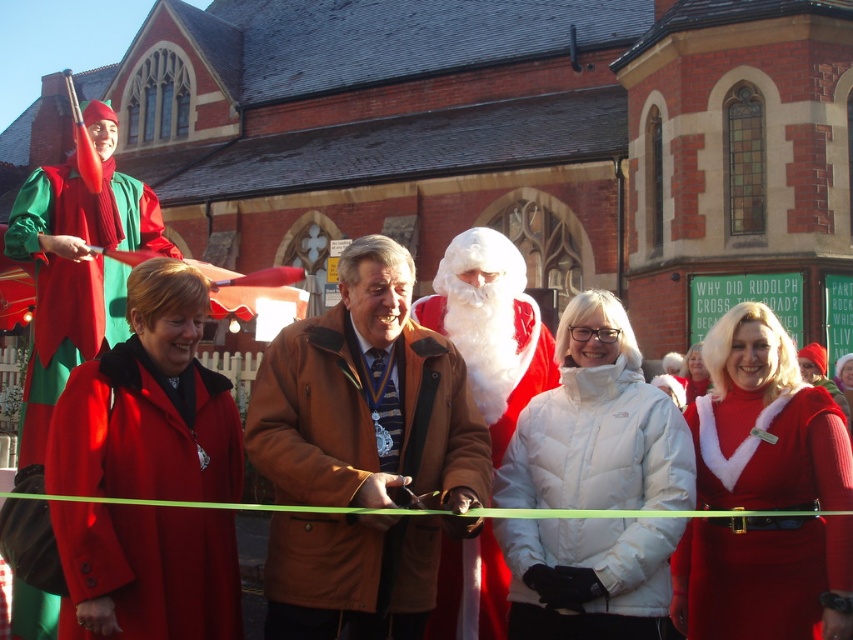
Which is more to the right, brown leather jacket at center or white fluffy santa at center?

white fluffy santa at center

Who is more distant from viewer, (390, 420) or (451, 612)?

Point (451, 612)

This screenshot has height=640, width=853. What are the coordinates of `brown leather jacket at center` in the screenshot? It's located at (367, 400).